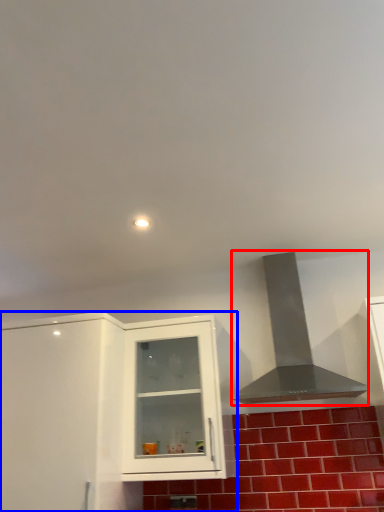
Question: Which object appears farthest to the camera in this image, vent (highlighted by a red box) or cabinetry (highlighted by a blue box)?

Choices:
 (A) vent
 (B) cabinetry

Answer: (A)